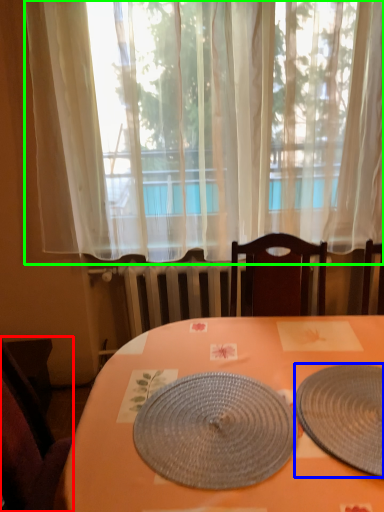
Question: Which object is the closest to the chair (highlighted by a red box)? Choose among these: plate (highlighted by a blue box) or curtain (highlighted by a green box).

Choices:
 (A) plate
 (B) curtain

Answer: (A)